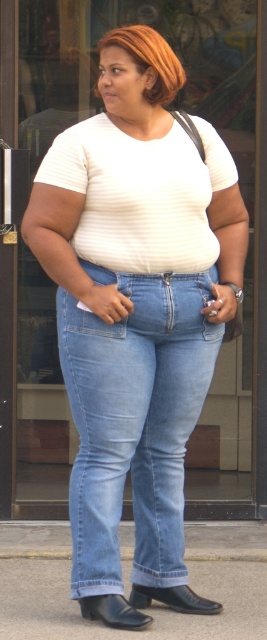
Question: Is white striped shirt at center positioned behind shiny orange hair at center?

Choices:
 (A) yes
 (B) no

Answer: (B)

Question: Which object is closer to the camera taking this photo?

Choices:
 (A) shiny orange hair at center
 (B) light blue denim jeans at center
 (C) white striped shirt at center

Answer: (C)

Question: In this image, where is white striped shirt at center located relative to shiny orange hair at center?

Choices:
 (A) right
 (B) left

Answer: (B)

Question: Which point is farther from the camera taking this photo?

Choices:
 (A) (190, 252)
 (B) (105, 42)
 (C) (143, 289)

Answer: (A)

Question: Which object appears farthest from the camera in this image?

Choices:
 (A) shiny orange hair at center
 (B) light blue denim jeans at center
 (C) white striped shirt at center

Answer: (B)

Question: Is light blue denim jeans at center further to the viewer compared to shiny orange hair at center?

Choices:
 (A) yes
 (B) no

Answer: (A)